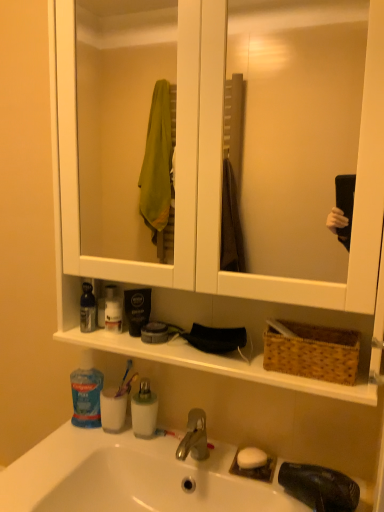
Locate an element on the screen. The image size is (384, 512). vacant region to the right of white opaque bottle at center, which is the first mouthwash in right-to-left order is located at coordinates (181, 454).